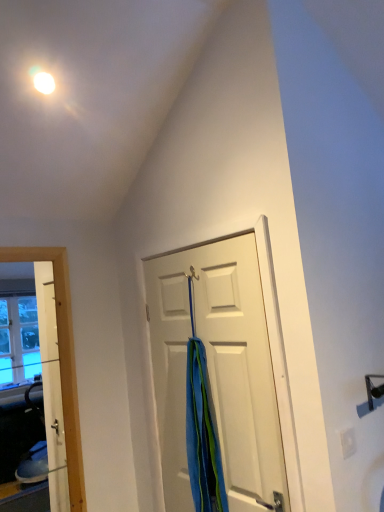
Question: Does blue fabric shower curtain at center come behind white matte door at center?

Choices:
 (A) no
 (B) yes

Answer: (B)

Question: From a real-world perspective, is blue fabric shower curtain at center on white matte door at center?

Choices:
 (A) no
 (B) yes

Answer: (A)

Question: From the image's perspective, is blue fabric shower curtain at center above white matte door at center?

Choices:
 (A) no
 (B) yes

Answer: (A)

Question: Is blue fabric shower curtain at center oriented away from white matte door at center?

Choices:
 (A) yes
 (B) no

Answer: (A)

Question: Is blue fabric shower curtain at center located outside white matte door at center?

Choices:
 (A) yes
 (B) no

Answer: (A)

Question: Is blue fabric shower curtain at center next to white matte door at center and touching it?

Choices:
 (A) no
 (B) yes

Answer: (A)

Question: Is white matte door at center shorter than blue fabric shower curtain at center?

Choices:
 (A) yes
 (B) no

Answer: (B)

Question: Does white matte door at center have a lesser width compared to blue fabric shower curtain at center?

Choices:
 (A) no
 (B) yes

Answer: (B)

Question: Is white matte door at center positioned beyond the bounds of blue fabric shower curtain at center?

Choices:
 (A) no
 (B) yes

Answer: (B)

Question: From a real-world perspective, is white matte door at center positioned under blue fabric shower curtain at center based on gravity?

Choices:
 (A) yes
 (B) no

Answer: (B)

Question: From a real-world perspective, is white matte door at center over blue fabric shower curtain at center?

Choices:
 (A) yes
 (B) no

Answer: (A)

Question: Can you confirm if white matte door at center is taller than blue fabric shower curtain at center?

Choices:
 (A) yes
 (B) no

Answer: (A)

Question: Considering the positions of blue fabric shower curtain at center and white matte door at center in the image, is blue fabric shower curtain at center bigger or smaller than white matte door at center?

Choices:
 (A) big
 (B) small

Answer: (B)